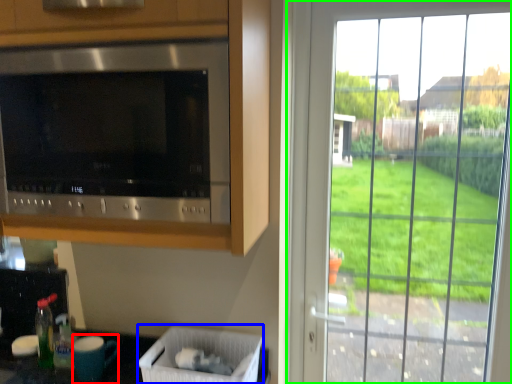
Question: Based on their relative distances, which object is farther from appliance (highlighted by a red box)? Choose from laundry basket (highlighted by a blue box) and window (highlighted by a green box).

Choices:
 (A) laundry basket
 (B) window

Answer: (B)